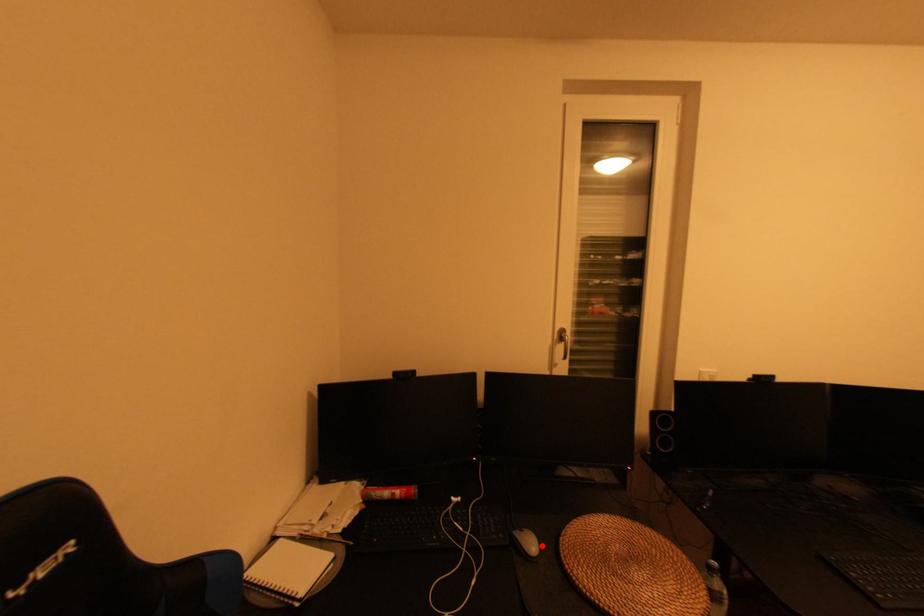
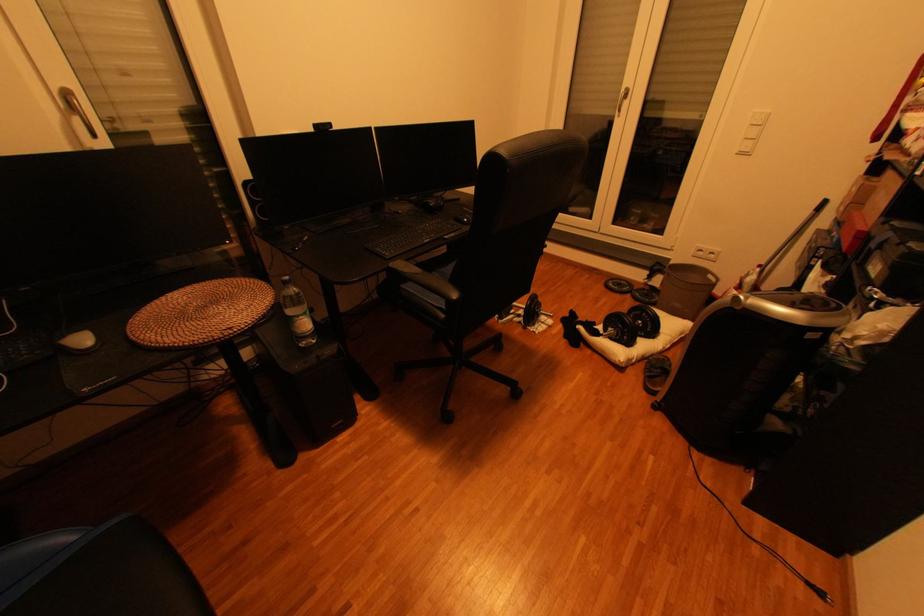
Locate, in the second image, the point that corresponds to the highlighted location in the first image.

(92, 341)